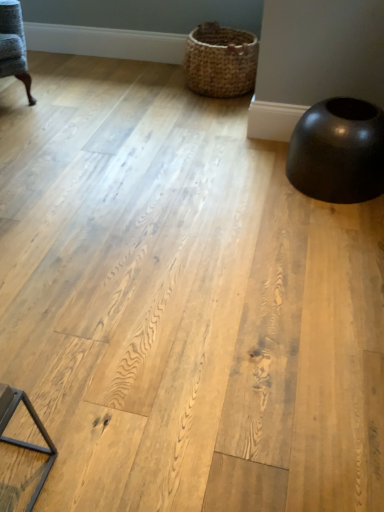
What do you see at coordinates (220, 61) in the screenshot? I see `woven brown basket at upper center` at bounding box center [220, 61].

Find the location of a particular element. The image size is (384, 512). woven brown basket at upper center is located at coordinates (x=220, y=61).

The height and width of the screenshot is (512, 384). Find the location of `woven brown basket at upper center`. woven brown basket at upper center is located at coordinates (220, 61).